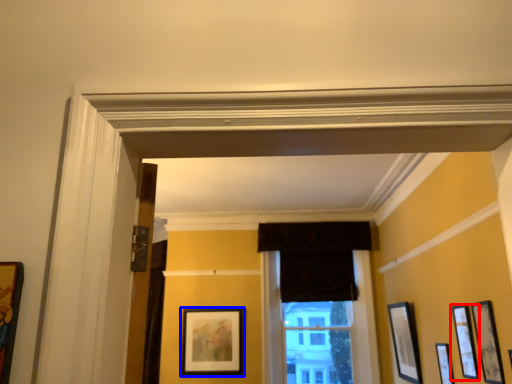
Question: Which point is closer to the camera, picture frame (highlighted by a red box) or picture frame (highlighted by a blue box)?

Choices:
 (A) picture frame
 (B) picture frame

Answer: (A)